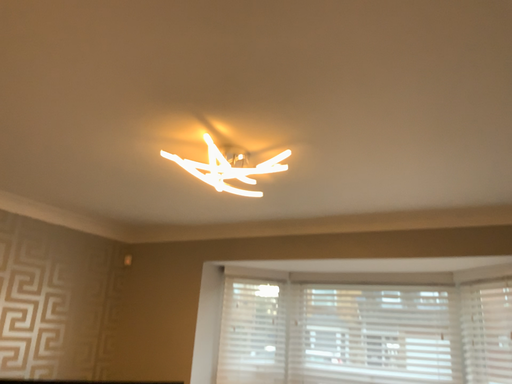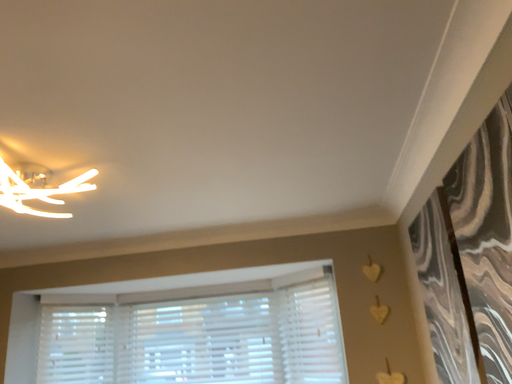
Question: How did the camera likely rotate when shooting the video?

Choices:
 (A) rotated right
 (B) rotated left

Answer: (A)